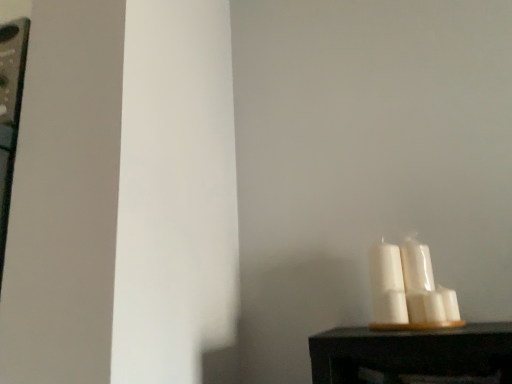
Question: Considering the relative sizes of white glossy candle at right, which ranks as the first candle in left-to-right order, and white matte candle at lower right, the second candle viewed from the left, in the image provided, is white glossy candle at right, which ranks as the first candle in left-to-right order, shorter than white matte candle at lower right, the second candle viewed from the left,?

Choices:
 (A) no
 (B) yes

Answer: (A)

Question: From a real-world perspective, is white glossy candle at right, which is counted as the second candle, starting from the right, on top of white matte candle at lower right, the second candle viewed from the left?

Choices:
 (A) yes
 (B) no

Answer: (A)

Question: Considering the relative positions of white glossy candle at right, which ranks as the first candle in left-to-right order, and white matte candle at lower right, which ranks as the first candle in right-to-left order, in the image provided, is white glossy candle at right, which ranks as the first candle in left-to-right order, to the left of white matte candle at lower right, which ranks as the first candle in right-to-left order, from the viewer's perspective?

Choices:
 (A) yes
 (B) no

Answer: (A)

Question: Is white glossy candle at right, which is counted as the second candle, starting from the right, looking in the opposite direction of white matte candle at lower right, the second candle viewed from the left?

Choices:
 (A) no
 (B) yes

Answer: (A)

Question: Can you confirm if white glossy candle at right, which is counted as the second candle, starting from the right, is bigger than white matte candle at lower right, which ranks as the first candle in right-to-left order?

Choices:
 (A) yes
 (B) no

Answer: (A)

Question: Does white glossy candle at right, which is counted as the second candle, starting from the right, have a greater height compared to white matte candle at lower right, the second candle viewed from the left?

Choices:
 (A) yes
 (B) no

Answer: (A)

Question: Can you confirm if white matte candle at lower right, which ranks as the first candle in right-to-left order, is smaller than white glossy candle at right, which is counted as the second candle, starting from the right?

Choices:
 (A) no
 (B) yes

Answer: (B)

Question: Is white glossy candle at right, which is counted as the second candle, starting from the right, at the back of white matte candle at lower right, the second candle viewed from the left?

Choices:
 (A) yes
 (B) no

Answer: (B)

Question: Is white matte candle at lower right, which ranks as the first candle in right-to-left order, not near white glossy candle at right, which is counted as the second candle, starting from the right?

Choices:
 (A) no
 (B) yes

Answer: (A)

Question: Is white matte candle at lower right, which ranks as the first candle in right-to-left order, at the right side of white glossy candle at right, which ranks as the first candle in left-to-right order?

Choices:
 (A) yes
 (B) no

Answer: (A)

Question: Is white matte candle at lower right, the second candle viewed from the left, to the left of white glossy candle at right, which ranks as the first candle in left-to-right order, from the viewer's perspective?

Choices:
 (A) no
 (B) yes

Answer: (A)

Question: Is white matte candle at lower right, the second candle viewed from the left, wider than white glossy candle at right, which ranks as the first candle in left-to-right order?

Choices:
 (A) no
 (B) yes

Answer: (A)

Question: In the image, is white matte candle at lower right, which ranks as the first candle in right-to-left order, on the left side or the right side of white glossy candle at right, which ranks as the first candle in left-to-right order?

Choices:
 (A) left
 (B) right

Answer: (B)